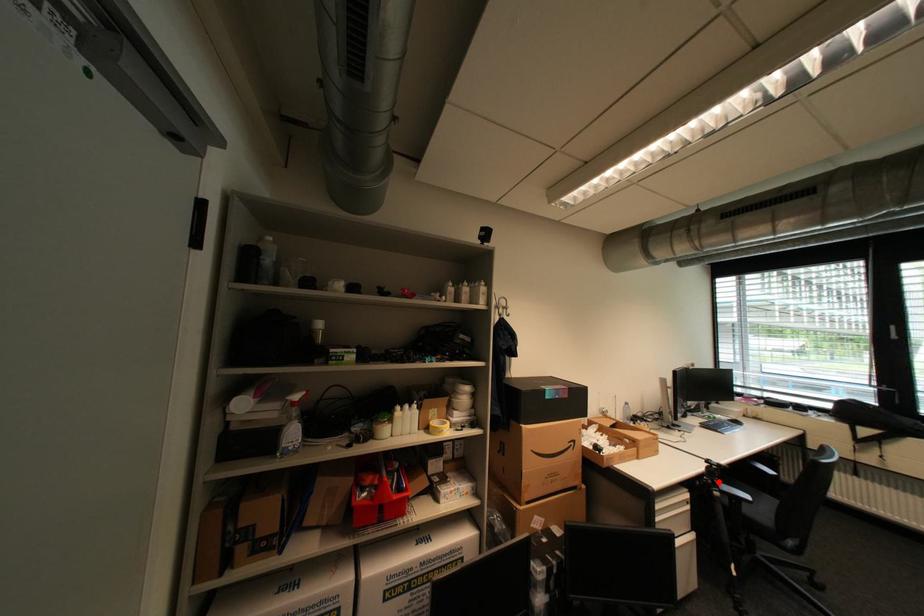
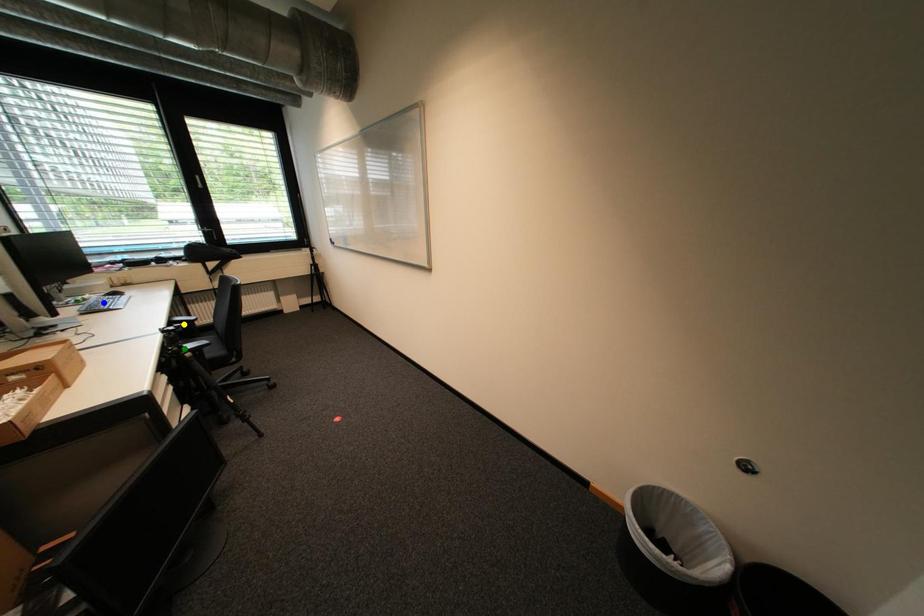
Question: I am providing you with two images of the same scene from different viewpoints. A red point is marked on the first image. You are given multiple points on the second image. Which point in image 2 represents the same 3d spot as the red point in image 1?

Choices:
 (A) yellow point
 (B) blue point
 (C) green point

Answer: (C)